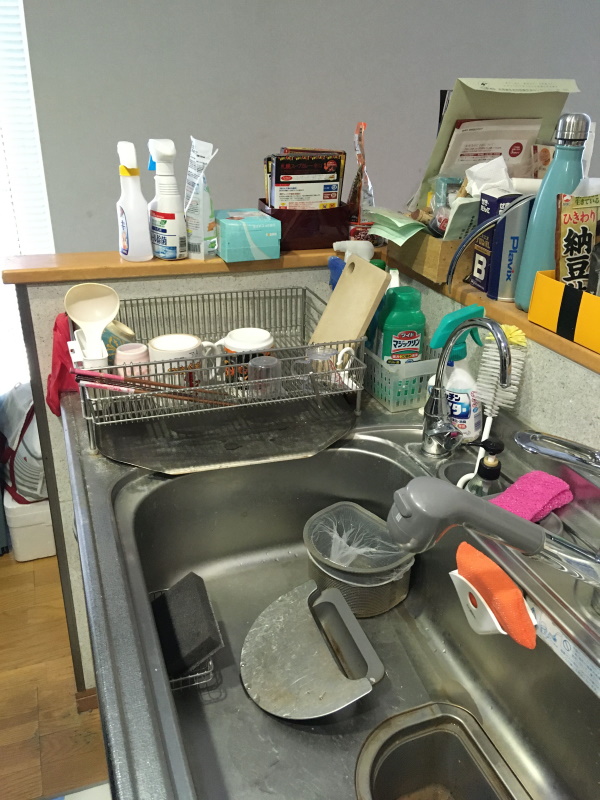
Image resolution: width=600 pixels, height=800 pixels. What are the coordinates of `wall` in the screenshot? It's located at (195, 68).